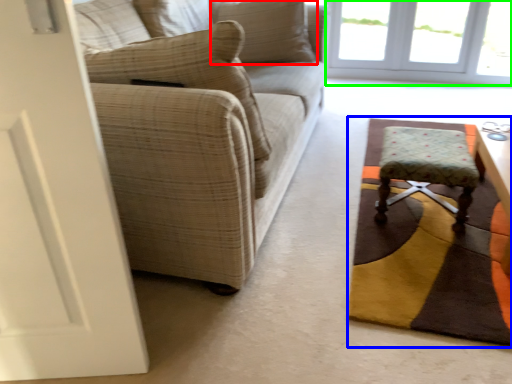
Question: Which is nearer to the pillow (highlighted by a red box)? mat (highlighted by a blue box) or window (highlighted by a green box).

Choices:
 (A) mat
 (B) window

Answer: (A)